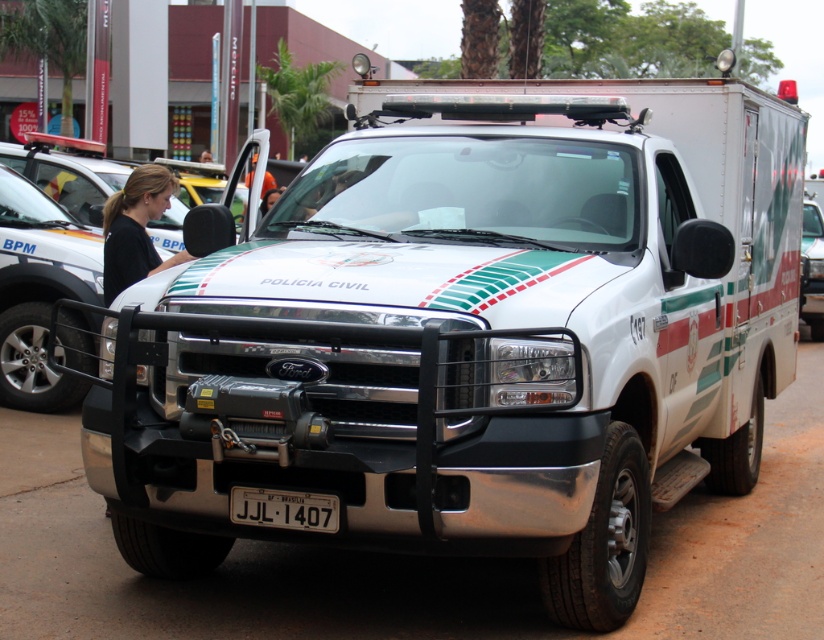
Question: Which point is farther to the camera?

Choices:
 (A) white plastic license plate at center
 (B) white glossy truck at center
 (C) black fabric shirt at center

Answer: (B)

Question: In this image, where is black fabric shirt at center located relative to white plastic license plate at center?

Choices:
 (A) right
 (B) left

Answer: (B)

Question: Which point is farther from the camera taking this photo?

Choices:
 (A) pos(143,186)
 (B) pos(260,504)
 (C) pos(820,284)

Answer: (C)

Question: Can you confirm if black fabric shirt at center is smaller than white plastic license plate at center?

Choices:
 (A) yes
 (B) no

Answer: (B)

Question: Is white plastic license plate at center wider than white glossy truck at center?

Choices:
 (A) no
 (B) yes

Answer: (A)

Question: Which object is the closest to the white glossy truck at center?

Choices:
 (A) white plastic license plate at center
 (B) black fabric shirt at center

Answer: (A)